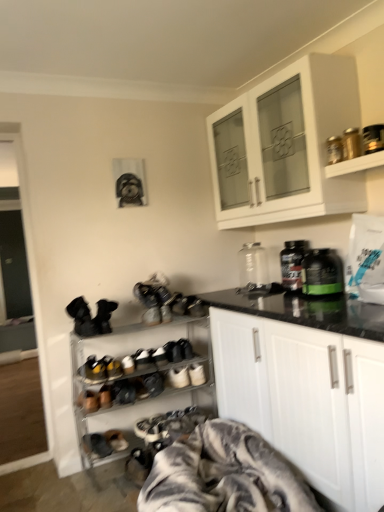
Describe the element at coordinates (138, 465) in the screenshot. I see `leather sneakers at center, the fourth footwear when ordered from top to bottom` at that location.

At what (x,y) coordinates should I click in order to perform the action: click on gray textured blanket at lower center. Please return your answer as a coordinate pair (x, y). The image size is (384, 512). Looking at the image, I should click on (223, 474).

How much space does metallic silver shoe rack at lower left, which is the second shelf from front to back, occupy horizontally?

13.36 inches.

The width and height of the screenshot is (384, 512). What do you see at coordinates (179, 377) in the screenshot?
I see `white suede sneakers at center, marked as the fourth footwear in a left-to-right arrangement` at bounding box center [179, 377].

This screenshot has height=512, width=384. In order to click on leather sneakers at center, the fourth footwear when ordered from top to bottom in this screenshot , I will do `click(138, 465)`.

Is point (340, 165) farther from viewer compared to point (365, 193)?

No, it is in front of (365, 193).

Is metallic gold canisters at upper right, which is the 2th shelf from bottom to top, not close to white matte cabinet at upper center, arranged as the first cabinetry when viewed from the top?

That's not correct — metallic gold canisters at upper right, which is the 2th shelf from bottom to top, is a little close to white matte cabinet at upper center, arranged as the first cabinetry when viewed from the top.

Is white matte cabinet at upper center, arranged as the first cabinetry when viewed from the top, located within metallic gold canisters at upper right, marked as the 1th shelf in a front-to-back arrangement?

That's incorrect, white matte cabinet at upper center, arranged as the first cabinetry when viewed from the top, is not inside metallic gold canisters at upper right, marked as the 1th shelf in a front-to-back arrangement.

Is metallic gold canisters at upper right, the second shelf viewed from the left, turned away from white matte cabinet at upper center, arranged as the first cabinetry when viewed from the top?

metallic gold canisters at upper right, the second shelf viewed from the left, is not turned away from white matte cabinet at upper center, arranged as the first cabinetry when viewed from the top.

Which is farther from the camera, (x=307, y=128) or (x=97, y=443)?

The point (x=97, y=443) is behind.

Looking at this image, from a real-world perspective, who is located lower, white matte cabinet at upper center, arranged as the first cabinetry when viewed from the top, or dark gray suede shoes at lower left, which is the second footwear from left to right?

In real-world perspective, dark gray suede shoes at lower left, which is the second footwear from left to right, is lower.

Does white matte cabinet at upper center, which is the second cabinetry in bottom-to-top order, come behind dark gray suede shoes at lower left, the third footwear from the top?

No, the depth of white matte cabinet at upper center, which is the second cabinetry in bottom-to-top order, is less than that of dark gray suede shoes at lower left, the third footwear from the top.

Measure the distance from white matte cabinet at upper center, which is the second cabinetry in bottom-to-top order, to dark gray suede shoes at lower left, which is the second footwear from left to right.

white matte cabinet at upper center, which is the second cabinetry in bottom-to-top order, is 1.91 meters from dark gray suede shoes at lower left, which is the second footwear from left to right.

Looking at this image, considering the relative sizes of dark gray suede shoes at lower left, which is the second footwear from left to right, and metallic silver shoe rack at lower left, which is the second shelf from front to back, in the image provided, is dark gray suede shoes at lower left, which is the second footwear from left to right, smaller than metallic silver shoe rack at lower left, which is the second shelf from front to back,?

Yes, dark gray suede shoes at lower left, which is the second footwear from left to right, is smaller than metallic silver shoe rack at lower left, which is the second shelf from front to back.

Is dark gray suede shoes at lower left, which is the second footwear in bottom-to-top order, taller or shorter than metallic silver shoe rack at lower left, the 1th shelf in the left-to-right sequence?

Clearly, dark gray suede shoes at lower left, which is the second footwear in bottom-to-top order, is shorter compared to metallic silver shoe rack at lower left, the 1th shelf in the left-to-right sequence.

Is dark gray suede shoes at lower left, which is the second footwear from left to right, aimed at metallic silver shoe rack at lower left, which appears as the second shelf when viewed from the right?

Yes, dark gray suede shoes at lower left, which is the second footwear from left to right, faces towards metallic silver shoe rack at lower left, which appears as the second shelf when viewed from the right.

From the image's perspective, is transparent glass bottle at center, arranged as the 3th bottle when viewed from the front, located above leather sneakers at center, which is the second footwear in right-to-left order?

Correct, transparent glass bottle at center, arranged as the 3th bottle when viewed from the front, appears higher than leather sneakers at center, which is the second footwear in right-to-left order, in the image.

Between transparent glass bottle at center, arranged as the 3th bottle when viewed from the front, and leather sneakers at center, the 1th footwear positioned from the bottom, which one has more height?

transparent glass bottle at center, arranged as the 3th bottle when viewed from the front.

Does transparent glass bottle at center, arranged as the 3th bottle when viewed from the front, come behind leather sneakers at center, the 1th footwear positioned from the bottom?

Yes, it is behind leather sneakers at center, the 1th footwear positioned from the bottom.

Considering the sizes of objects transparent glass bottle at center, which ranks as the 1th bottle in back-to-front order, and leather sneakers at center, the 1th footwear positioned from the bottom, in the image provided, who is smaller, transparent glass bottle at center, which ranks as the 1th bottle in back-to-front order, or leather sneakers at center, the 1th footwear positioned from the bottom,?

Smaller between the two is leather sneakers at center, the 1th footwear positioned from the bottom.

From the image's perspective, which one is positioned higher, green matte bottle at right, the 3th bottle positioned from the back, or gray textured blanket at lower center?

green matte bottle at right, the 3th bottle positioned from the back.

Does green matte bottle at right, the 3th bottle positioned from the back, have a lesser width compared to gray textured blanket at lower center?

Yes.

Based on the photo, from a real-world perspective, does green matte bottle at right, arranged as the 1th bottle when viewed from the front, sit lower than gray textured blanket at lower center?

No.

Is green matte bottle at right, arranged as the 1th bottle when viewed from the front, aimed at gray textured blanket at lower center?

No, green matte bottle at right, arranged as the 1th bottle when viewed from the front, is not aimed at gray textured blanket at lower center.

Is white suede sneakers at center, marked as the 4th footwear in a bottom-to-top arrangement, completely or partially outside of transparent glass bottle at center, arranged as the 3th bottle when viewed from the front?

Yes, white suede sneakers at center, marked as the 4th footwear in a bottom-to-top arrangement, is located beyond the bounds of transparent glass bottle at center, arranged as the 3th bottle when viewed from the front.

Who is smaller, white suede sneakers at center, which is counted as the first footwear, starting from the top, or transparent glass bottle at center, arranged as the 3th bottle when viewed from the front?

Smaller between the two is white suede sneakers at center, which is counted as the first footwear, starting from the top.

Between white suede sneakers at center, the 1th footwear from the right, and transparent glass bottle at center, arranged as the 3th bottle when viewed from the front, which one has larger width?

Wider between the two is white suede sneakers at center, the 1th footwear from the right.

Between white matte cabinet at center, which appears as the 2th cabinetry when viewed from the top, and white matte cabinet at upper center, which is the second cabinetry in bottom-to-top order, which one appears on the right side from the viewer's perspective?

white matte cabinet at center, which appears as the 2th cabinetry when viewed from the top.

At what (x,y) coordinates should I click in order to perform the action: click on cabinetry in front of the white matte cabinet at upper center, arranged as the first cabinetry when viewed from the top. Please return your answer as a coordinate pair (x, y). This screenshot has height=512, width=384. Looking at the image, I should click on (307, 400).

Could you tell me if white matte cabinet at center, which is counted as the first cabinetry, starting from the bottom, is facing white matte cabinet at upper center, arranged as the first cabinetry when viewed from the top?

No.

Considering the positions of point (241, 365) and point (322, 209), is point (241, 365) closer or farther from the camera than point (322, 209)?

Point (241, 365) is farther from the camera than point (322, 209).

From a real-world perspective, which shelf is the 1st one underneath the white matte cabinet at upper center, arranged as the first cabinetry when viewed from the top? Please provide its 2D coordinates.

[(355, 164)]

From the white matte cabinet at upper center, which is the second cabinetry in bottom-to-top order, count the 3rd footwear to the left and point to it. Please provide its 2D coordinates.

[(104, 443)]

Considering their positions, is white matte cabinet at center, which is counted as the first cabinetry, starting from the bottom, positioned further to green matte bottle at right, arranged as the 1th bottle when viewed from the front, than leather sneakers at center, the fourth footwear when ordered from top to bottom?

Among the two, leather sneakers at center, the fourth footwear when ordered from top to bottom, is located further to green matte bottle at right, arranged as the 1th bottle when viewed from the front.

Considering their positions, is transparent glass bottle at center, which ranks as the 1th bottle in back-to-front order, positioned closer to brown suede shoes at lower left, placed as the fourth footwear when sorted from right to left, than dark gray suede shoes at lower left, which is the second footwear in bottom-to-top order?

Among the two, dark gray suede shoes at lower left, which is the second footwear in bottom-to-top order, is located nearer to brown suede shoes at lower left, placed as the fourth footwear when sorted from right to left.

Which object lies further to the anchor point green matte bottle at right, the 3th bottle positioned from the back, leather sneakers at center, the fourth footwear when ordered from top to bottom, or dark gray suede shoes at lower left, the third footwear from the top?

dark gray suede shoes at lower left, the third footwear from the top.

Looking at the image, which one is located closer to white matte cabinet at upper center, which is the second cabinetry in bottom-to-top order, brown suede shoes at lower left, placed as the fourth footwear when sorted from right to left, or dark gray suede shoes at lower left, which is the second footwear in bottom-to-top order?

brown suede shoes at lower left, placed as the fourth footwear when sorted from right to left.

Considering their positions, is leather sneakers at center, the fourth footwear when ordered from top to bottom, positioned closer to green matte bottle at right, arranged as the 1th bottle when viewed from the front, than gray textured blanket at lower center?

gray textured blanket at lower center lies closer to green matte bottle at right, arranged as the 1th bottle when viewed from the front, than the other object.

When comparing their distances from metallic gold canisters at upper right, marked as the 1th shelf in a front-to-back arrangement, does black plastic bottle at center, which appears as the 2th bottle when viewed from the front, or brown suede shoes at lower left, placed as the fourth footwear when sorted from right to left, seem further?

brown suede shoes at lower left, placed as the fourth footwear when sorted from right to left.

Estimate the real-world distances between objects in this image. Which object is closer to transparent glass bottle at center, which ranks as the 1th bottle in back-to-front order, white suede sneakers at center, marked as the 4th footwear in a bottom-to-top arrangement, or gray textured blanket at lower center?

white suede sneakers at center, marked as the 4th footwear in a bottom-to-top arrangement.

Estimate the real-world distances between objects in this image. Which object is closer to white matte cabinet at upper center, arranged as the first cabinetry when viewed from the top, white suede sneakers at center, marked as the fourth footwear in a left-to-right arrangement, or dark gray suede shoes at lower left, placed as the third footwear when sorted from right to left?

Among the two, white suede sneakers at center, marked as the fourth footwear in a left-to-right arrangement, is located nearer to white matte cabinet at upper center, arranged as the first cabinetry when viewed from the top.

Where is `cabinetry between metallic gold canisters at upper right, positioned as the 2th shelf in back-to-front order, and dark gray suede shoes at lower left, which is the second footwear from left to right, in the vertical direction`? cabinetry between metallic gold canisters at upper right, positioned as the 2th shelf in back-to-front order, and dark gray suede shoes at lower left, which is the second footwear from left to right, in the vertical direction is located at coordinates (307, 400).

Where is `shelf located between dark gray suede shoes at lower left, which is the second footwear in bottom-to-top order, and white suede sneakers at center, marked as the fourth footwear in a left-to-right arrangement, in the left-right direction`? The image size is (384, 512). shelf located between dark gray suede shoes at lower left, which is the second footwear in bottom-to-top order, and white suede sneakers at center, marked as the fourth footwear in a left-to-right arrangement, in the left-right direction is located at coordinates (139, 380).

What are the coordinates of `blanket situated between brown suede shoes at lower left, which appears as the 2th footwear when viewed from the top, and white matte cabinet at center, which appears as the 2th cabinetry when viewed from the top, from left to right` in the screenshot? It's located at (223, 474).

Find the location of a particular element. The width and height of the screenshot is (384, 512). shelf between black plastic bottle at center, which appears as the 2th bottle when viewed from the front, and leather sneakers at center, which is the second footwear in right-to-left order, vertically is located at coordinates (139, 380).